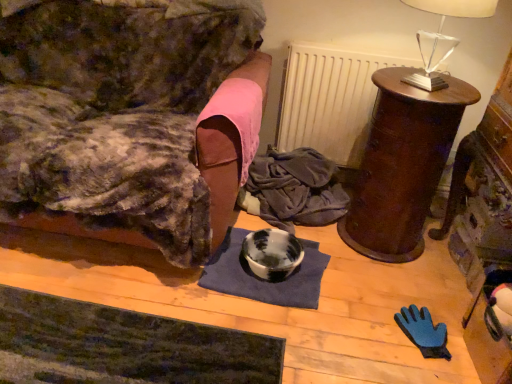
You are a GUI agent. You are given a task and a screenshot of the screen. Output one action in this format:
    pyautogui.click(x=<x>, y=<y>)
    Task: Click on the free space in front of mahogany wood side table at right, which ranks as the first furniture in right-to-left order
    The width and height of the screenshot is (512, 384).
    Given the screenshot: What is the action you would take?
    pyautogui.click(x=391, y=287)